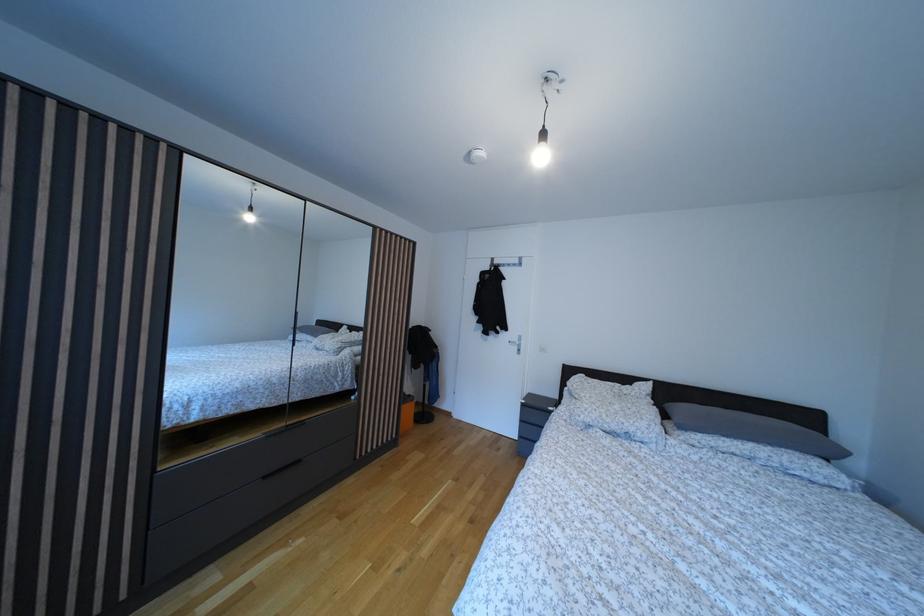
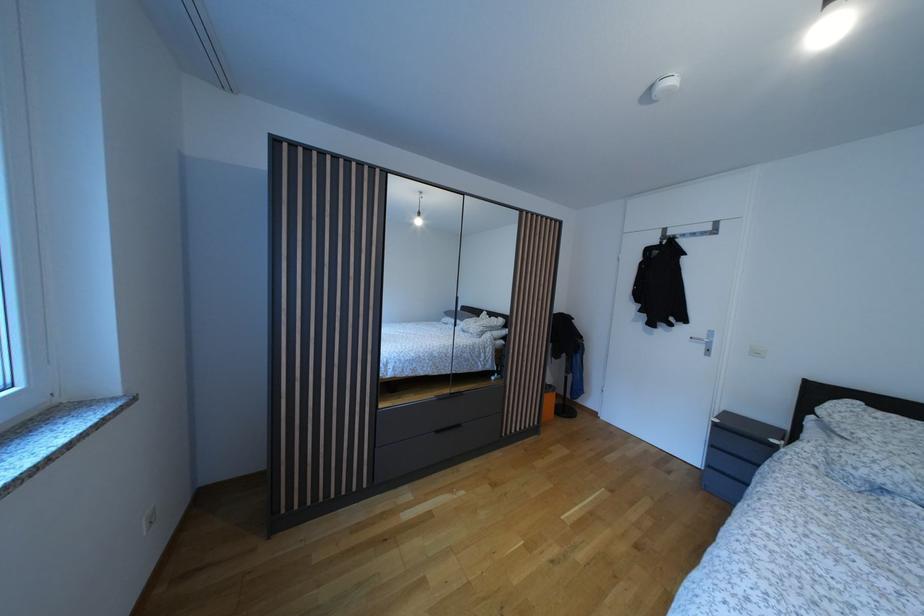
Question: Which direction would the cameraman need to move to produce the second image? Reply with the corresponding letter.

Choices:
 (A) Left
 (B) Right
 (C) Forward
 (D) Backward

Answer: (A)